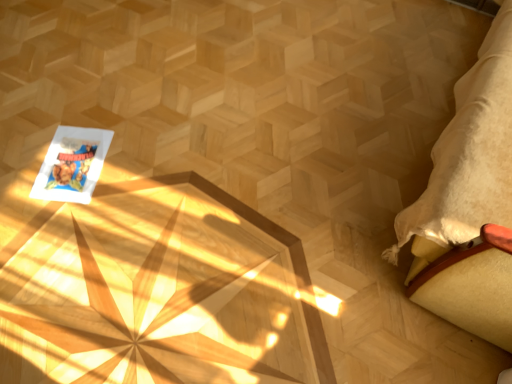
Question: Should I look upward or downward to see beige fabric cushion at right?

Choices:
 (A) up
 (B) down

Answer: (A)